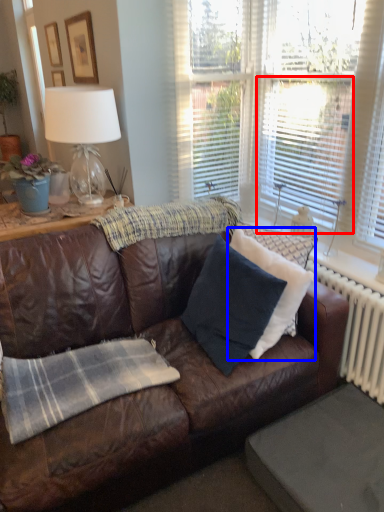
Question: Which object is closer to the camera taking this photo, window screen (highlighted by a red box) or pillow (highlighted by a blue box)?

Choices:
 (A) window screen
 (B) pillow

Answer: (B)